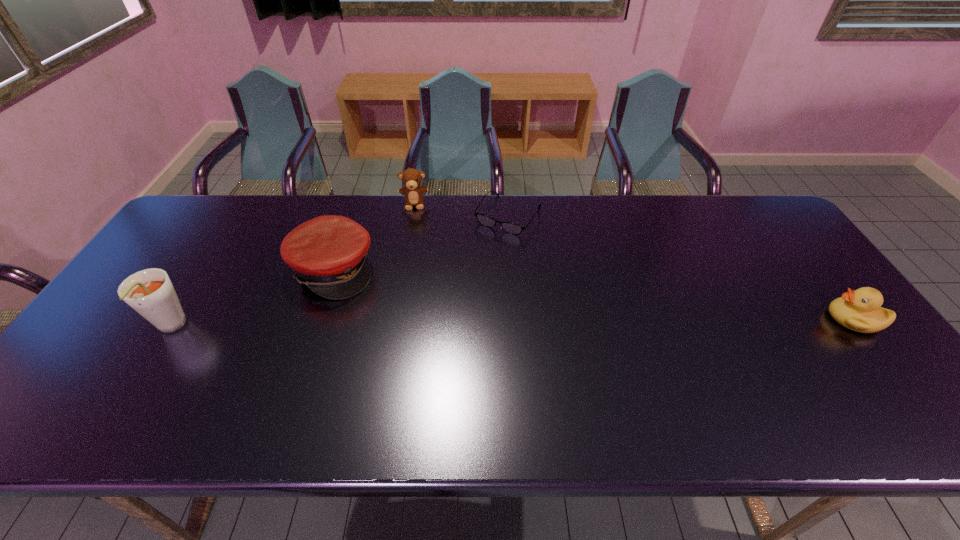
The width and height of the screenshot is (960, 540). What are the coordinates of `vacant space situated on the beak of the rightmost object` in the screenshot? It's located at (780, 319).

Locate an element on the screen. This screenshot has height=540, width=960. free space located on the front of the third nearest object with an emblem is located at coordinates (481, 342).

The image size is (960, 540). What are the coordinates of `vacant region located 0.120m on the front of the third nearest object with an emblem` in the screenshot? It's located at (398, 301).

The width and height of the screenshot is (960, 540). In order to click on blank space located 0.180m on the front of the third nearest object with an emblem in this screenshot , I will do point(417,310).

What are the coordinates of `vacant space located 0.050m on the front-facing side of the shortest object` in the screenshot? It's located at (487, 245).

Identify the location of free location located 0.310m on the front-facing side of the shortest object. This screenshot has height=540, width=960. (447, 302).

Find the location of a particular element. This screenshot has height=540, width=960. vacant space located on the front-facing side of the shortest object is located at coordinates [x=434, y=321].

This screenshot has height=540, width=960. In order to click on vacant area located 0.190m on the face of the third object from left to right in this screenshot , I will do `click(414, 248)`.

Where is `free space located on the face of the third object from left to right`? free space located on the face of the third object from left to right is located at coordinates (414, 273).

The image size is (960, 540). Find the location of `vacant area situated on the face of the third object from left to right`. vacant area situated on the face of the third object from left to right is located at coordinates (414, 264).